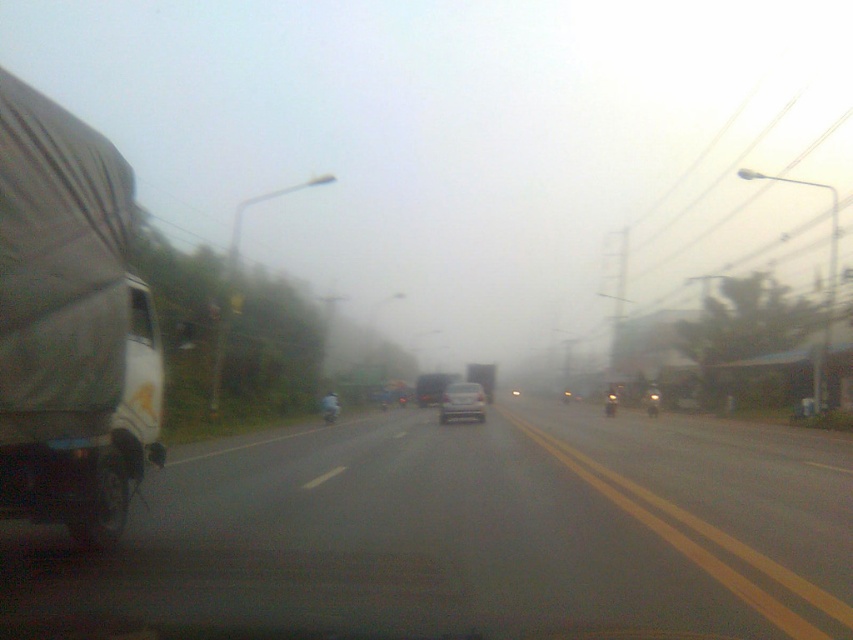
You are driving a car and see the black matte truck at left and the silver metallic sedan at center. Which vehicle is nearer to you?

The black matte truck at left is closer to the viewer than the silver metallic sedan at center.

You are driving a car and need to pass a large truck ahead. You see a black matte truck at left and a white matte trailer truck at left. Which truck is closer to the center of the road?

The black matte truck at left is closer to the center of the road because it is positioned to the right of the white matte trailer truck at left, meaning it is nearer to the road center marked by the double yellow line.